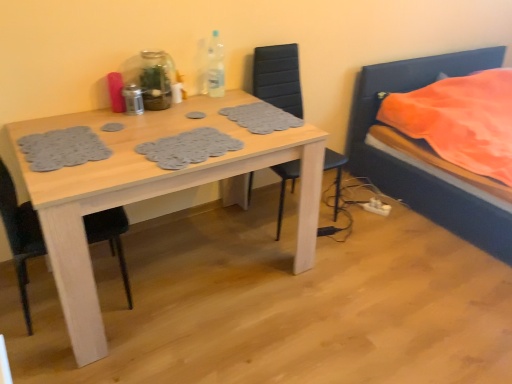
The height and width of the screenshot is (384, 512). I want to click on vacant region to the right of light wood table at center, so point(365,284).